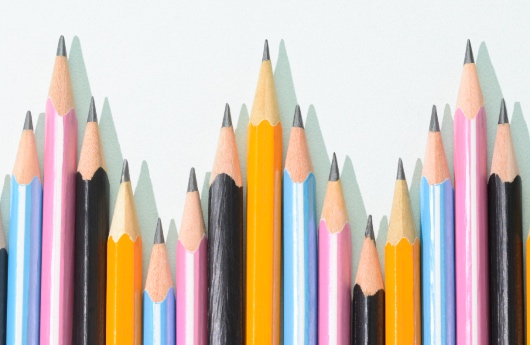
At what (x,y) coordinates should I click in order to perform the action: click on blue or pink pencil. Please return your answer as a coordinate pair (x, y). Looking at the image, I should click on (21, 274), (55, 275), (156, 317), (187, 317), (295, 301), (325, 304), (437, 306), (470, 305).